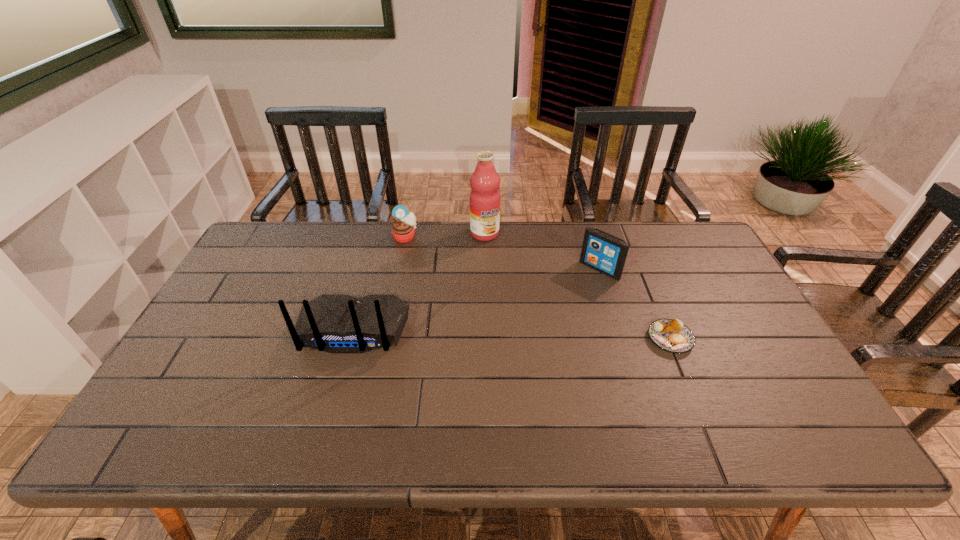
Where is `router`? The image size is (960, 540). router is located at coordinates (338, 324).

Find the location of a particular element. the shortest object is located at coordinates (671, 335).

You are a GUI agent. You are given a task and a screenshot of the screen. Output one action in this format:
    pyautogui.click(x=<x>, y=<y>)
    Task: Click on the rightmost object
    The image size is (960, 540).
    Given the screenshot: What is the action you would take?
    pyautogui.click(x=671, y=335)

You are a GUI agent. You are given a task and a screenshot of the screen. Output one action in this format:
    pyautogui.click(x=<x>, y=<y>)
    Task: Click on the muffin
    This screenshot has width=960, height=540.
    Given the screenshot: What is the action you would take?
    [x=403, y=229]

At what (x,y) coordinates should I click in order to perform the action: click on the tallest object. Please return your answer as a coordinate pair (x, y). Looking at the image, I should click on (484, 200).

Identify the location of the third object from left to right. (484, 200).

Find the location of `the third farthest object`. the third farthest object is located at coordinates (605, 253).

Identify the location of iPod. (605, 253).

I want to click on vacant area situated on the back of the second tallest object, so click(334, 396).

Identify the location of vacant space positioned 0.310m on the left of the pastry. The height and width of the screenshot is (540, 960). (533, 339).